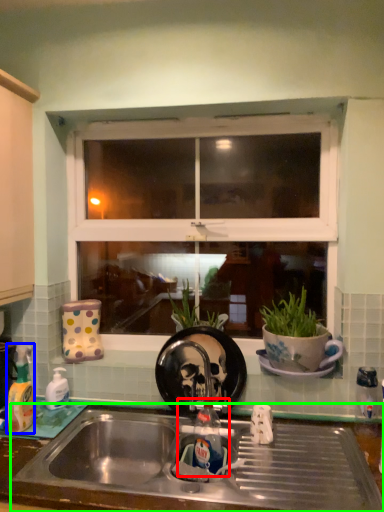
Question: Which object is positioned farthest from tap (highlighted by a red box)? Select from bottle (highlighted by a blue box) and sink (highlighted by a green box).

Choices:
 (A) bottle
 (B) sink

Answer: (A)